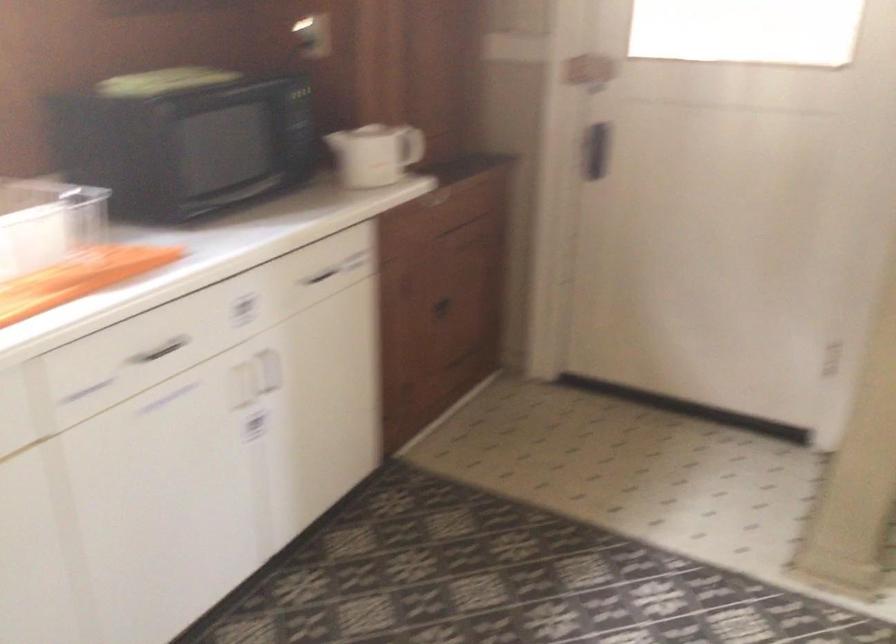
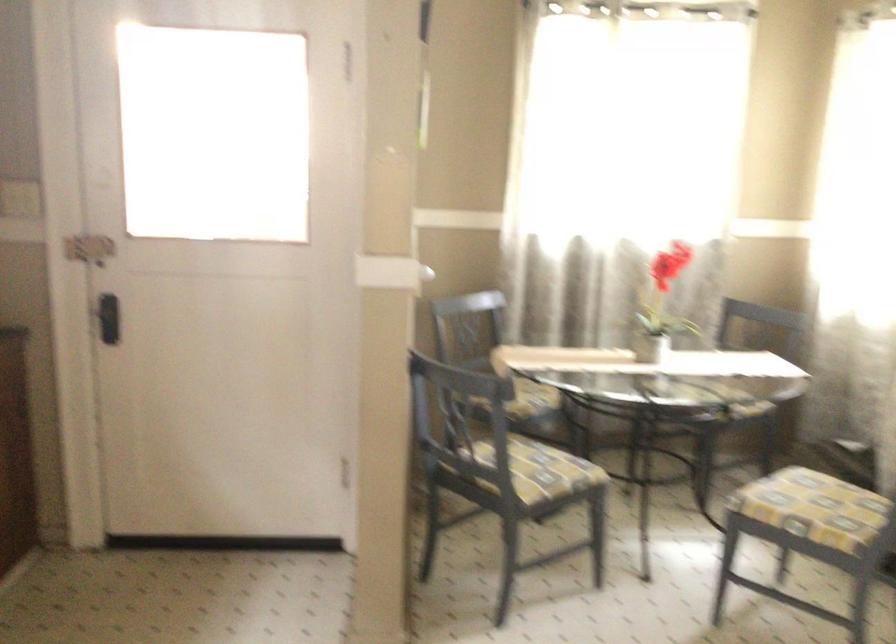
Locate, in the second image, the point that corresponds to point (580, 146) in the first image.

(108, 317)